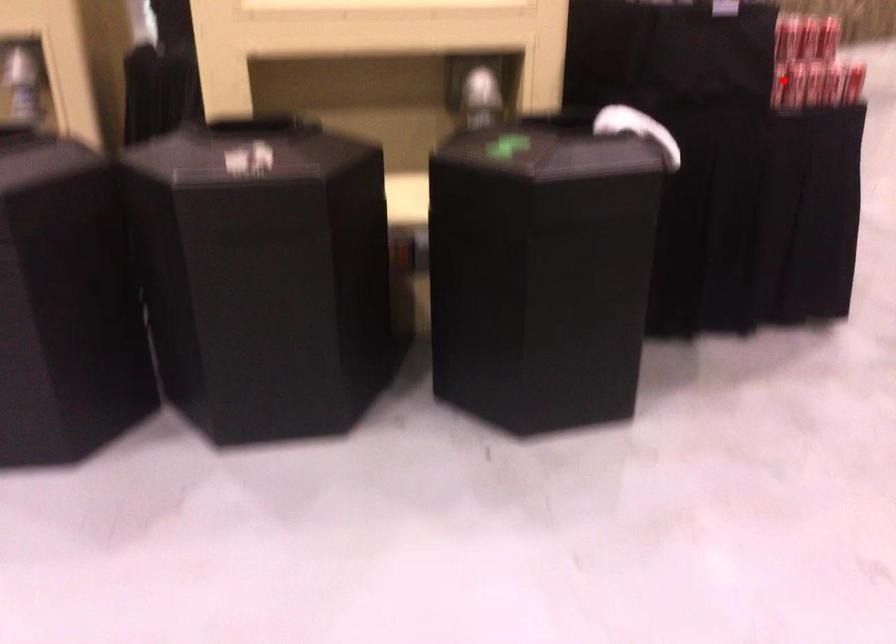
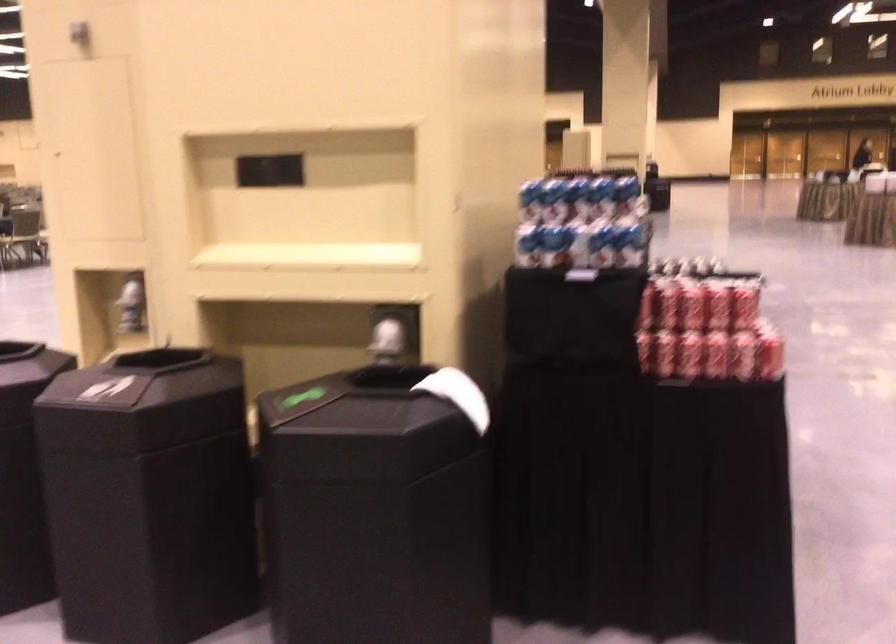
Where in the second image is the point corresponding to the highlighted location from the first image?

(664, 353)